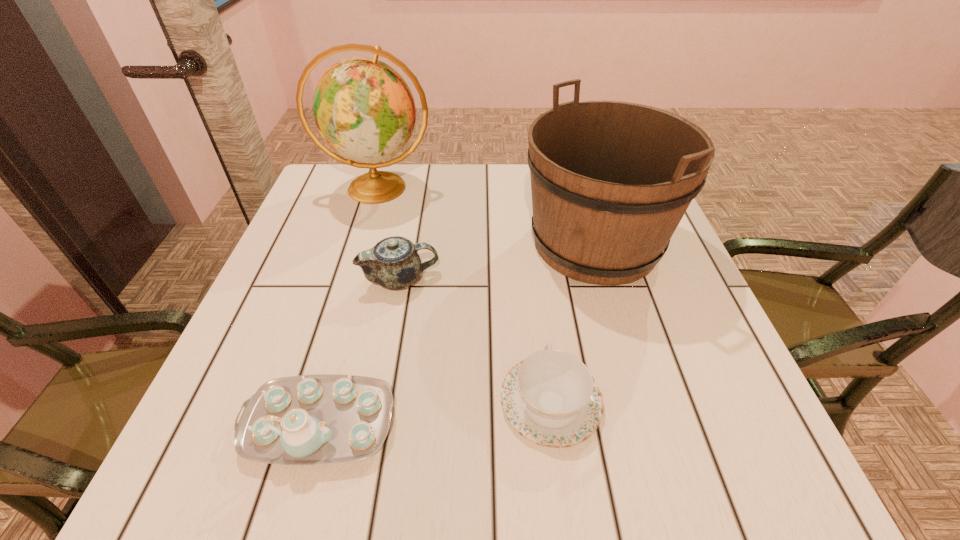
Where is `globe`? Image resolution: width=960 pixels, height=540 pixels. globe is located at coordinates 363,108.

Identify the location of the fourth shortest object. click(610, 181).

This screenshot has width=960, height=540. I want to click on the farthest chinaware, so click(393, 263).

At what (x,y) coordinates should I click in order to perform the action: click on the shortest chinaware. Please return your answer as a coordinate pair (x, y). Looking at the image, I should click on (550, 398).

I want to click on the rightmost chinaware, so click(x=550, y=398).

You are a GUI agent. You are given a task and a screenshot of the screen. Output one action in this format:
    pyautogui.click(x=<x>, y=<y>)
    Task: Click on the free point located on the front of the globe
    The image size is (960, 540).
    Given the screenshot: What is the action you would take?
    pyautogui.click(x=338, y=320)

Locate an element on the screen. The width and height of the screenshot is (960, 540). vacant space located on the left of the bucket is located at coordinates (420, 243).

You are a GUI agent. You are given a task and a screenshot of the screen. Output one action in this format:
    pyautogui.click(x=<x>, y=<y>)
    Task: Click on the free space located from the spout of the farthest chinaware
    The image size is (960, 540).
    Given the screenshot: What is the action you would take?
    pyautogui.click(x=589, y=279)

The width and height of the screenshot is (960, 540). I want to click on vacant space located 0.190m on the handle side of the shortest object, so (536, 286).

At what (x,y) coordinates should I click in order to perform the action: click on vacant space situated on the handle side of the shortest object. Please return your answer as a coordinate pair (x, y). Looking at the image, I should click on (539, 310).